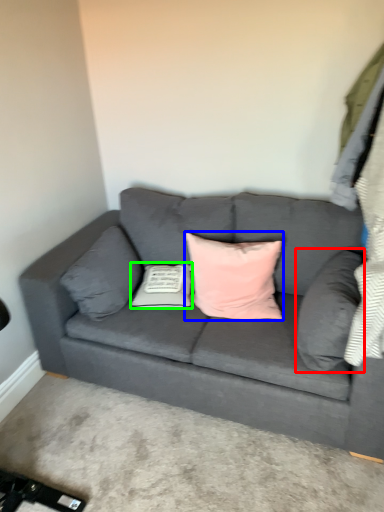
Question: Which object is positioned farthest from pillow (highlighted by a red box)? Select from pillow (highlighted by a blue box) and pillow (highlighted by a green box).

Choices:
 (A) pillow
 (B) pillow

Answer: (B)